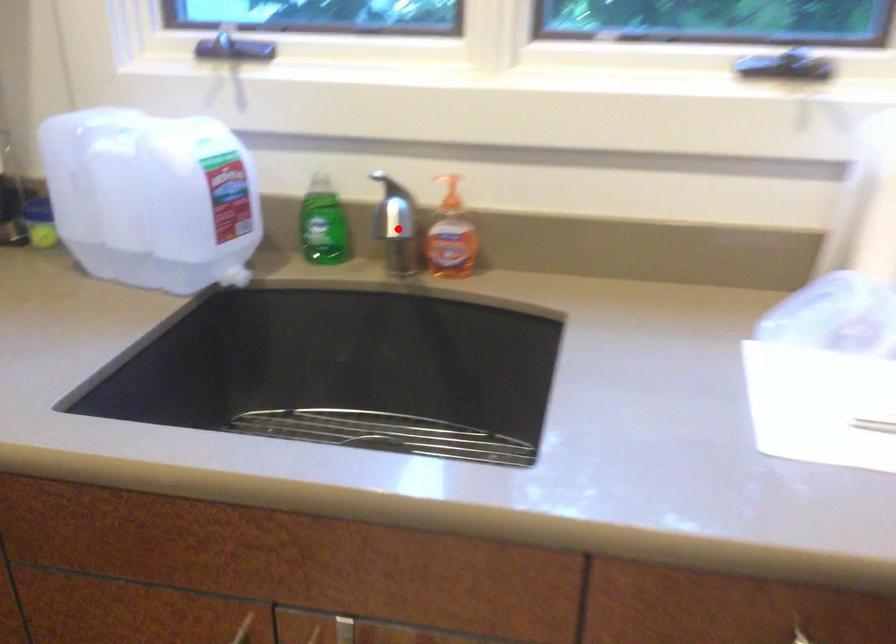
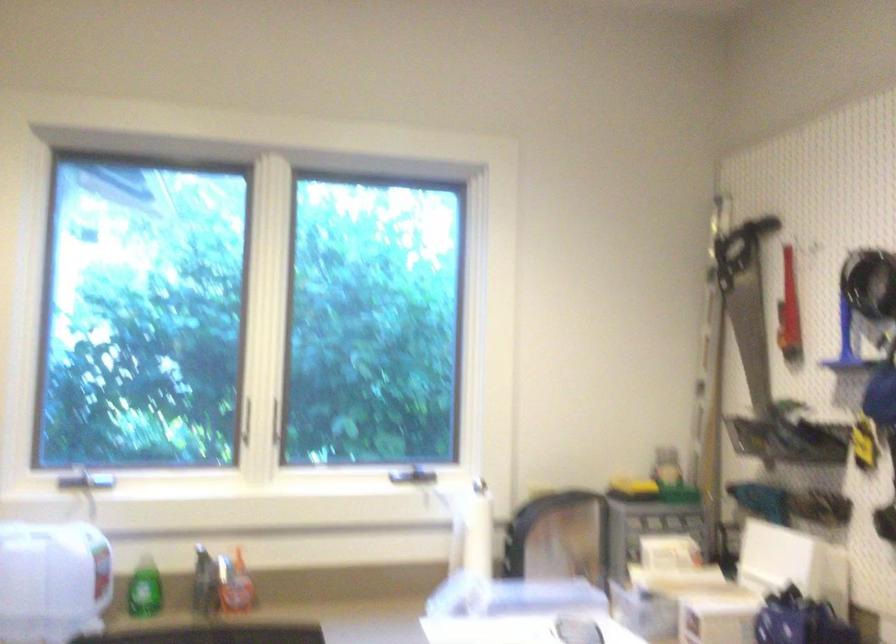
Question: I am providing you with two images of the same scene from different viewpoints. A red point is marked on the first image. At the location where the point appears in image 1, is it still visible in image 2?

Choices:
 (A) Yes
 (B) No

Answer: (A)